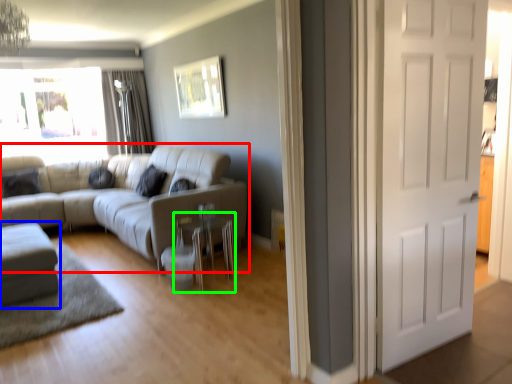
Question: Which object is the farthest from studio couch (highlighted by a red box)? Choose among these: studio couch (highlighted by a blue box) or side table (highlighted by a green box).

Choices:
 (A) studio couch
 (B) side table

Answer: (A)